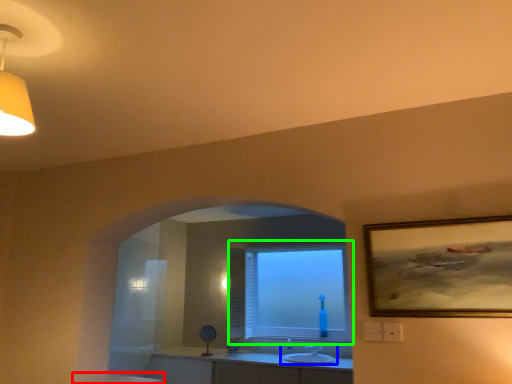
Question: Which object is the farthest from counter top (highlighted by a red box)? Choose among these: sink (highlighted by a blue box) or window (highlighted by a green box).

Choices:
 (A) sink
 (B) window

Answer: (B)